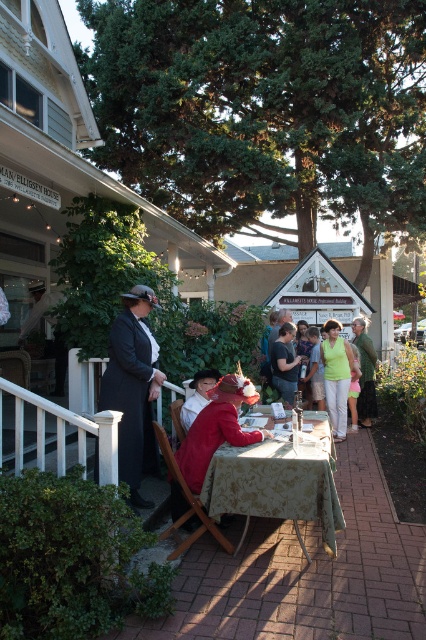
You are a photographer standing at the edge of the scene wanting to capture both the dark gray cotton shirt at center and the green fabric dress at center in a single photo. Given that your camera has a maximum focus range of 1.5 meters, will you be able to include both subjects in sharp focus?

The distance between the dark gray cotton shirt at center and the green fabric dress at center is 1.35 meters, which is within the camera maximum focus range of 1.5 meters. Therefore, the photographer can capture both subjects in sharp focus.

You are organizing a photo shoot and need to know which of the two outfits takes up more space in the frame. Based on the scene, which is wider, the dark gray cotton shirt at center or the green fabric dress at center?

The green fabric dress at center is wider than the dark gray cotton shirt at center.

You are a photographer at the Willamette House event, and you want to capture a photo where both the green floral tablecloth at center and the matte red dress at center are clearly visible. Considering their heights, which object should be placed closer to the camera to ensure both are in focus?

The green floral tablecloth at center is taller than the matte red dress at center. To ensure both are in focus, place the taller green floral tablecloth closer to the camera so that the depth of field can accommodate both heights.